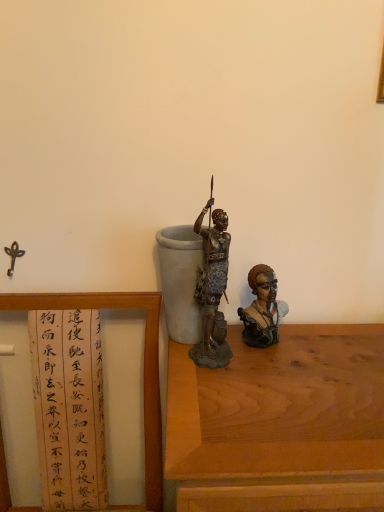
Question: Which direction should I rotate to face bronze statue at center, the second person when ordered from right to left, — up or down?

Choices:
 (A) up
 (B) down

Answer: (B)

Question: Can you confirm if wooden framed paper at left is positioned to the left of matte brown bust at right, marked as the 2th person in a left-to-right arrangement?

Choices:
 (A) yes
 (B) no

Answer: (A)

Question: Is wooden framed paper at left positioned in front of matte brown bust at right, marked as the 2th person in a left-to-right arrangement?

Choices:
 (A) no
 (B) yes

Answer: (B)

Question: Is wooden framed paper at left shorter than matte brown bust at right, which is counted as the 1th person, starting from the right?

Choices:
 (A) no
 (B) yes

Answer: (A)

Question: From a real-world perspective, is wooden framed paper at left positioned under matte brown bust at right, marked as the 2th person in a left-to-right arrangement, based on gravity?

Choices:
 (A) no
 (B) yes

Answer: (B)

Question: Is wooden framed paper at left completely or partially outside of matte brown bust at right, marked as the 2th person in a left-to-right arrangement?

Choices:
 (A) no
 (B) yes

Answer: (B)

Question: Is wooden framed paper at left turned away from matte brown bust at right, marked as the 2th person in a left-to-right arrangement?

Choices:
 (A) yes
 (B) no

Answer: (B)

Question: Is there a large distance between matte brown bust at right, which is counted as the 1th person, starting from the right, and wooden framed paper at left?

Choices:
 (A) no
 (B) yes

Answer: (A)

Question: From the image's perspective, does matte brown bust at right, marked as the 2th person in a left-to-right arrangement, appear lower than wooden framed paper at left?

Choices:
 (A) yes
 (B) no

Answer: (B)

Question: Can you confirm if matte brown bust at right, marked as the 2th person in a left-to-right arrangement, is smaller than wooden framed paper at left?

Choices:
 (A) yes
 (B) no

Answer: (A)

Question: Does matte brown bust at right, marked as the 2th person in a left-to-right arrangement, contain wooden framed paper at left?

Choices:
 (A) yes
 (B) no

Answer: (B)

Question: Considering the relative sizes of matte brown bust at right, marked as the 2th person in a left-to-right arrangement, and wooden framed paper at left in the image provided, is matte brown bust at right, marked as the 2th person in a left-to-right arrangement, shorter than wooden framed paper at left?

Choices:
 (A) yes
 (B) no

Answer: (A)

Question: Can you confirm if matte brown bust at right, marked as the 2th person in a left-to-right arrangement, is wider than wooden framed paper at left?

Choices:
 (A) no
 (B) yes

Answer: (A)

Question: Would you say bronze statue at center, the first person in the left-to-right sequence, contains matte brown bust at right, which is counted as the 1th person, starting from the right?

Choices:
 (A) yes
 (B) no

Answer: (B)